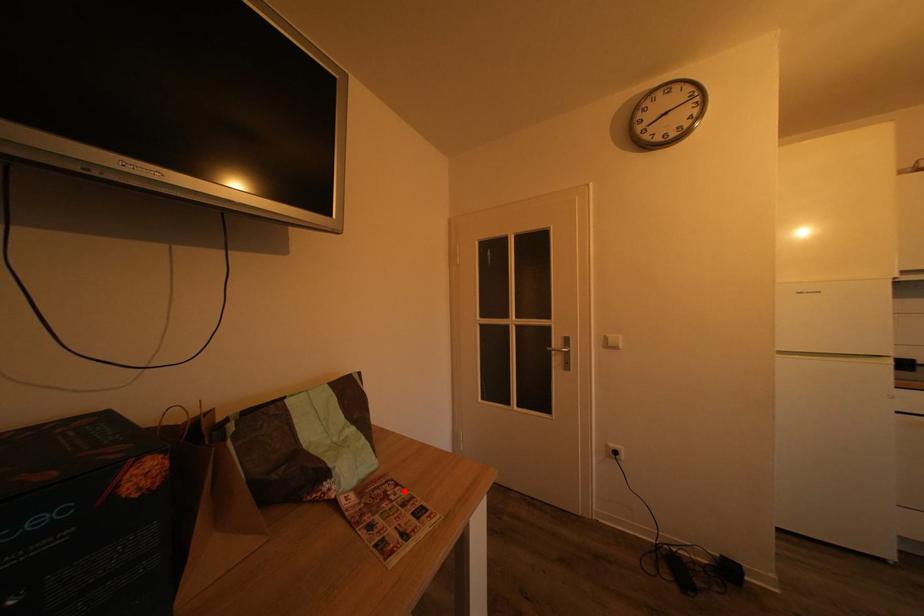
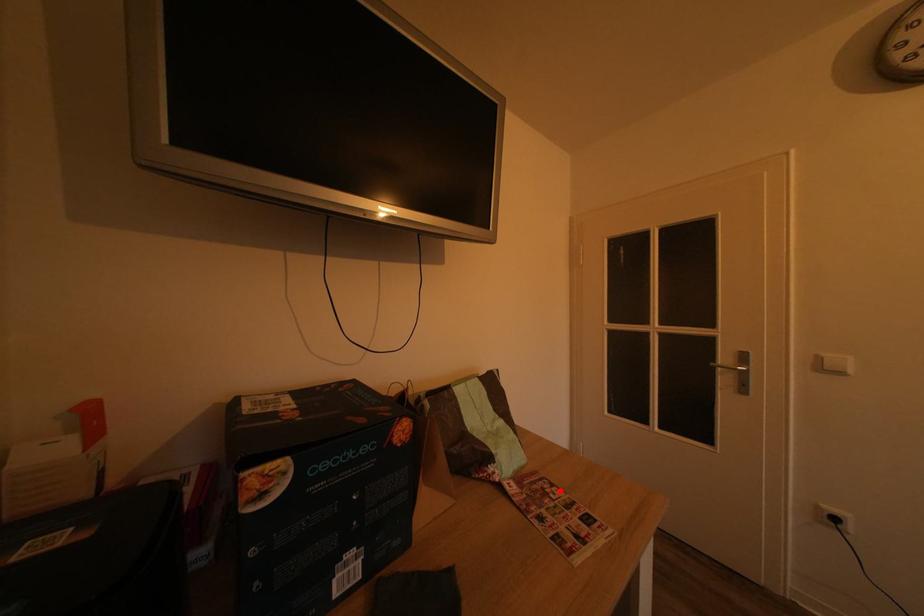
I am providing you with two images of the same scene from different viewpoints. A red point is marked on the first image and another point is marked on the second image. Does the point marked in image1 correspond to the same location as the one in image2?

Yes